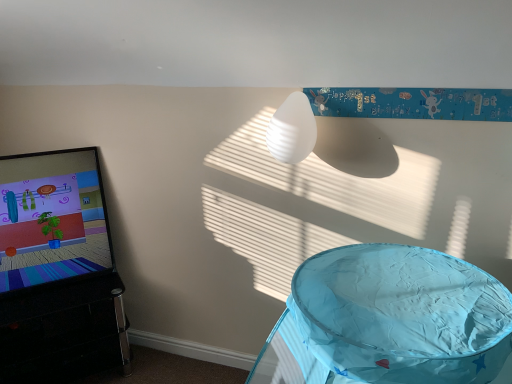
Find the location of a particular element. This screenshot has height=384, width=512. white ribbed lampshade at upper center is located at coordinates (292, 130).

Measure the distance between point [340,274] and camera.

Point [340,274] is 1.36 meters away from camera.

The height and width of the screenshot is (384, 512). I want to click on black glossy tv stand at left, which ranks as the 2th furniture in front-to-back order, so (x=64, y=332).

Find the location of a particular element. white ribbed lampshade at upper center is located at coordinates (292, 130).

Would you say black glossy tv stand at left, which ranks as the 2th furniture in front-to-back order, is inside or outside matte black screen at left?

black glossy tv stand at left, which ranks as the 2th furniture in front-to-back order, cannot be found inside matte black screen at left.

Is black glossy tv stand at left, placed as the second furniture when sorted from right to left, at the right side of matte black screen at left?

Yes.

From a real-world perspective, is black glossy tv stand at left, which ranks as the 2th furniture in front-to-back order, positioned above or below matte black screen at left?

black glossy tv stand at left, which ranks as the 2th furniture in front-to-back order, is situated lower than matte black screen at left in the real world.

Considering the sizes of black glossy tv stand at left, which ranks as the 2th furniture in front-to-back order, and matte black screen at left in the image, is black glossy tv stand at left, which ranks as the 2th furniture in front-to-back order, taller or shorter than matte black screen at left?

Answer: black glossy tv stand at left, which ranks as the 2th furniture in front-to-back order, is shorter than matte black screen at left.

Is the depth of white ribbed lampshade at upper center less than that of blue fabric play tent at lower right, the 2th furniture positioned from the back?

No, it is behind blue fabric play tent at lower right, the 2th furniture positioned from the back.

Is point (297, 150) less distant than point (425, 328)?

No.

Looking at their sizes, would you say white ribbed lampshade at upper center is wider or thinner than blue fabric play tent at lower right, the 2th furniture positioned from the back?

white ribbed lampshade at upper center is thinner than blue fabric play tent at lower right, the 2th furniture positioned from the back.

Locate an element on the screen. This screenshot has width=512, height=384. lamp in front of the matte black screen at left is located at coordinates (292, 130).

Which of these two, white ribbed lampshade at upper center or matte black screen at left, is smaller?

white ribbed lampshade at upper center.

Is point (310, 105) closer to camera compared to point (10, 202)?

That is True.

Is white ribbed lampshade at upper center inside the boundaries of matte black screen at left, or outside?

white ribbed lampshade at upper center exists outside the volume of matte black screen at left.

Consider the image. From the image's perspective, relative to blue fabric play tent at lower right, placed as the first furniture when sorted from right to left, is black glossy tv stand at left, placed as the second furniture when sorted from right to left, above or below?

From the image's perspective, black glossy tv stand at left, placed as the second furniture when sorted from right to left, appears below blue fabric play tent at lower right, placed as the first furniture when sorted from right to left.

Does black glossy tv stand at left, placed as the second furniture when sorted from right to left, turn towards blue fabric play tent at lower right, placed as the first furniture when sorted from right to left?

Yes, black glossy tv stand at left, placed as the second furniture when sorted from right to left, is aimed at blue fabric play tent at lower right, placed as the first furniture when sorted from right to left.

Is black glossy tv stand at left, which is counted as the first furniture, starting from the back, in front of or behind blue fabric play tent at lower right, placed as the first furniture when sorted from right to left, in the image?

black glossy tv stand at left, which is counted as the first furniture, starting from the back, is behind blue fabric play tent at lower right, placed as the first furniture when sorted from right to left.

From a real-world perspective, who is located higher, black glossy tv stand at left, which is counted as the first furniture, starting from the back, or blue fabric play tent at lower right, placed as the first furniture when sorted from right to left?

blue fabric play tent at lower right, placed as the first furniture when sorted from right to left.

Which of these two, matte black screen at left or black glossy tv stand at left, which is counted as the first furniture, starting from the back, is thinner?

matte black screen at left is thinner.

Is matte black screen at left positioned in front of black glossy tv stand at left, which ranks as the 2th furniture in front-to-back order?

No, it is not.

Is matte black screen at left shorter than black glossy tv stand at left, which is counted as the first furniture, starting from the back?

Incorrect, the height of matte black screen at left does not fall short of that of black glossy tv stand at left, which is counted as the first furniture, starting from the back.

Which is more to the right, matte black screen at left or black glossy tv stand at left, which is counted as the first furniture, starting from the back?

black glossy tv stand at left, which is counted as the first furniture, starting from the back.

From the picture: Which is more to the right, matte black screen at left or blue fabric play tent at lower right, the 1th furniture viewed from the front?

blue fabric play tent at lower right, the 1th furniture viewed from the front.

Who is shorter, matte black screen at left or blue fabric play tent at lower right, the 1th furniture viewed from the front?

matte black screen at left is shorter.

From the image's perspective, relative to blue fabric play tent at lower right, the 1th furniture viewed from the front, is matte black screen at left above or below?

matte black screen at left is situated higher than blue fabric play tent at lower right, the 1th furniture viewed from the front, in the image.

Measure the distance from white ribbed lampshade at upper center to black glossy tv stand at left, placed as the second furniture when sorted from right to left.

white ribbed lampshade at upper center is 1.36 meters from black glossy tv stand at left, placed as the second furniture when sorted from right to left.

Based on the photo, considering the relative positions of white ribbed lampshade at upper center and black glossy tv stand at left, which ranks as the 2th furniture in front-to-back order, in the image provided, is white ribbed lampshade at upper center to the left of black glossy tv stand at left, which ranks as the 2th furniture in front-to-back order, from the viewer's perspective?

In fact, white ribbed lampshade at upper center is to the right of black glossy tv stand at left, which ranks as the 2th furniture in front-to-back order.

Does white ribbed lampshade at upper center touch black glossy tv stand at left, which ranks as the 2th furniture in front-to-back order?

No, white ribbed lampshade at upper center is not making contact with black glossy tv stand at left, which ranks as the 2th furniture in front-to-back order.

Is white ribbed lampshade at upper center facing away from black glossy tv stand at left, which ranks as the 2th furniture in front-to-back order?

white ribbed lampshade at upper center does not have its back to black glossy tv stand at left, which ranks as the 2th furniture in front-to-back order.

The height and width of the screenshot is (384, 512). What are the coordinates of `furniture that is the 2nd one when counting downward from the matte black screen at left (from the image's perspective)` in the screenshot? It's located at (64, 332).

Image resolution: width=512 pixels, height=384 pixels. In order to click on lamp located on the left of blue fabric play tent at lower right, placed as the first furniture when sorted from right to left in this screenshot , I will do [292, 130].

From the image, which object appears to be nearer to matte black screen at left, white ribbed lampshade at upper center or blue fabric play tent at lower right, positioned as the second furniture in left-to-right order?

white ribbed lampshade at upper center lies closer to matte black screen at left than the other object.

Considering their positions, is matte black screen at left positioned further to blue fabric play tent at lower right, the 1th furniture viewed from the front, than black glossy tv stand at left, which ranks as the 2th furniture in front-to-back order?

matte black screen at left.

When comparing their distances from black glossy tv stand at left, placed as the second furniture when sorted from right to left, does white ribbed lampshade at upper center or blue fabric play tent at lower right, the 1th furniture viewed from the front, seem further?

white ribbed lampshade at upper center is further to black glossy tv stand at left, placed as the second furniture when sorted from right to left.

Considering their positions, is white ribbed lampshade at upper center positioned further to blue fabric play tent at lower right, the 2th furniture positioned from the back, than black glossy tv stand at left, which is counted as the first furniture, starting from the back?

black glossy tv stand at left, which is counted as the first furniture, starting from the back.

Considering their positions, is matte black screen at left positioned closer to white ribbed lampshade at upper center than black glossy tv stand at left, which is counted as the first furniture, starting from the back?

Based on the image, matte black screen at left appears to be nearer to white ribbed lampshade at upper center.

Estimate the real-world distances between objects in this image. Which object is further from black glossy tv stand at left, which is counted as the first furniture, starting from the back, matte black screen at left or blue fabric play tent at lower right, positioned as the second furniture in left-to-right order?

Based on the image, blue fabric play tent at lower right, positioned as the second furniture in left-to-right order, appears to be further to black glossy tv stand at left, which is counted as the first furniture, starting from the back.

From the image, which object appears to be nearer to white ribbed lampshade at upper center, blue fabric play tent at lower right, placed as the first furniture when sorted from right to left, or matte black screen at left?

Based on the image, blue fabric play tent at lower right, placed as the first furniture when sorted from right to left, appears to be nearer to white ribbed lampshade at upper center.

Estimate the real-world distances between objects in this image. Which object is closer to blue fabric play tent at lower right, positioned as the second furniture in left-to-right order, matte black screen at left or white ribbed lampshade at upper center?

The object closer to blue fabric play tent at lower right, positioned as the second furniture in left-to-right order, is white ribbed lampshade at upper center.

Locate an element on the screen. lamp between matte black screen at left and blue fabric play tent at lower right, the 2th furniture positioned from the back is located at coordinates (292, 130).

Image resolution: width=512 pixels, height=384 pixels. I want to click on furniture situated between matte black screen at left and white ribbed lampshade at upper center from left to right, so click(x=64, y=332).

Where is `furniture located between matte black screen at left and blue fabric play tent at lower right, the 1th furniture viewed from the front, in the left-right direction`? furniture located between matte black screen at left and blue fabric play tent at lower right, the 1th furniture viewed from the front, in the left-right direction is located at coordinates (64, 332).

The image size is (512, 384). What are the coordinates of `lamp located between black glossy tv stand at left, placed as the second furniture when sorted from right to left, and blue fabric play tent at lower right, the 2th furniture positioned from the back, in the left-right direction` in the screenshot? It's located at (292, 130).